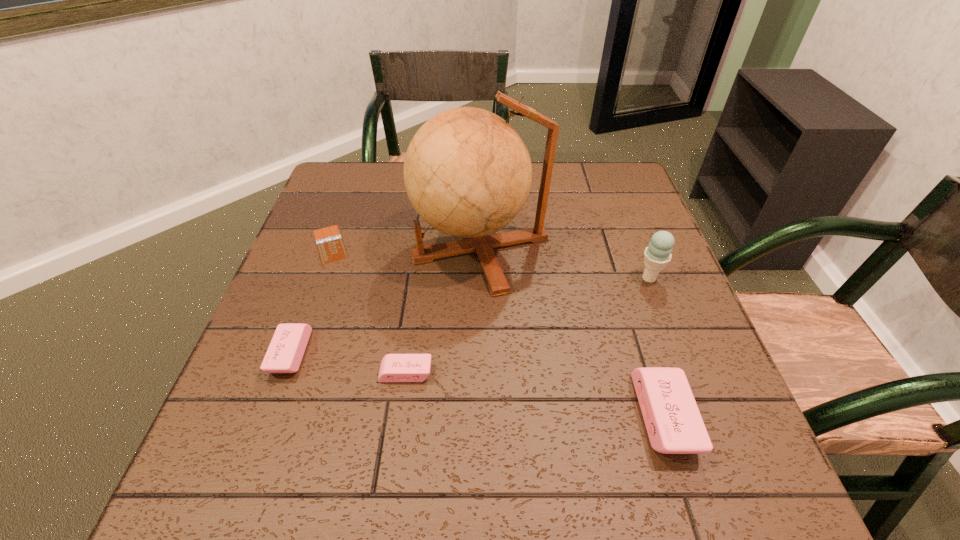
To make them evenly spaced by inserting another eraser among them, please locate a free space for this new eraser. Please provide its 2D coordinates. Your answer should be formatted as a tuple, i.e. [(x, y)], where the tuple contains the x and y coordinates of a point satisfying the conditions above.

[(530, 393)]